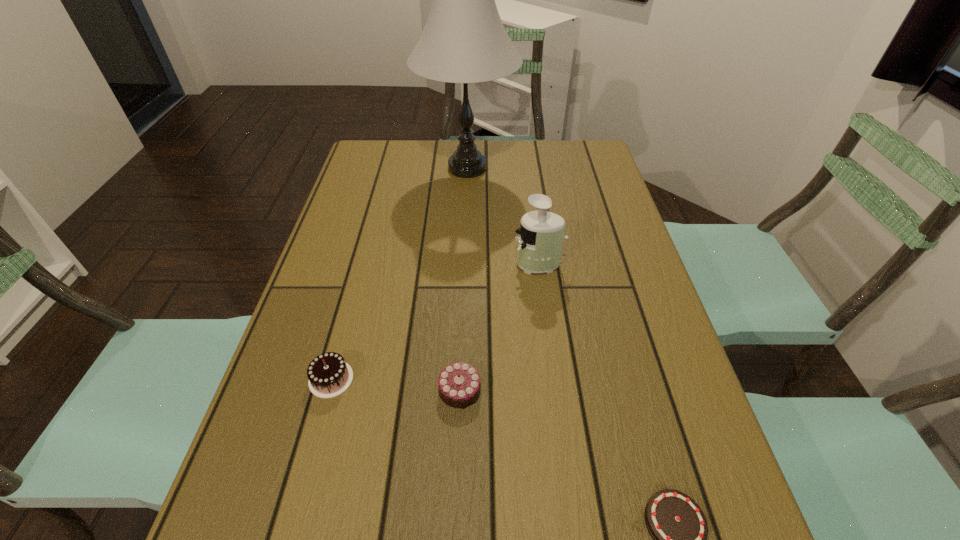
The width and height of the screenshot is (960, 540). I want to click on lamp, so click(x=464, y=40).

Image resolution: width=960 pixels, height=540 pixels. I want to click on the tallest object, so click(464, 40).

I want to click on juicer, so click(x=541, y=233).

At what (x,y) coordinates should I click in order to perform the action: click on the second tallest object. Please return your answer as a coordinate pair (x, y). The width and height of the screenshot is (960, 540). Looking at the image, I should click on (541, 233).

Locate an element on the screen. This screenshot has width=960, height=540. the leftmost object is located at coordinates pos(329,375).

Where is `the leftmost chocolate cake`? This screenshot has height=540, width=960. the leftmost chocolate cake is located at coordinates (329, 375).

You are a GUI agent. You are given a task and a screenshot of the screen. Output one action in this format:
    pyautogui.click(x=<x>, y=<y>)
    Task: Click on the second chocolate cake from right to left
    This screenshot has height=540, width=960.
    Given the screenshot: What is the action you would take?
    pyautogui.click(x=459, y=384)

At what (x,y) coordinates should I click in order to perform the action: click on the second shortest chocolate cake. Please return your answer as a coordinate pair (x, y). The image size is (960, 540). Looking at the image, I should click on (459, 384).

Identify the location of vacant space positioned 0.120m on the right of the tallest object. (554, 168).

The width and height of the screenshot is (960, 540). What are the coordinates of `vacant area situated on the back of the juicer` in the screenshot? It's located at (529, 196).